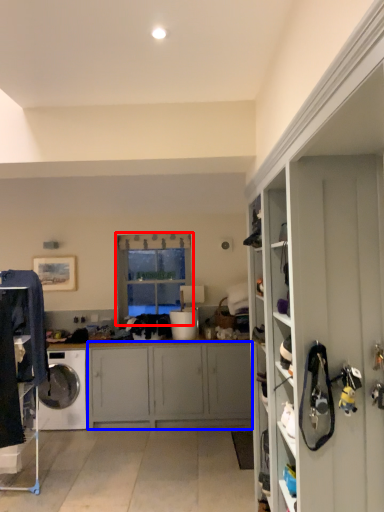
Question: Which of the following is the farthest to the observer, window (highlighted by a red box) or cabinetry (highlighted by a blue box)?

Choices:
 (A) window
 (B) cabinetry

Answer: (A)